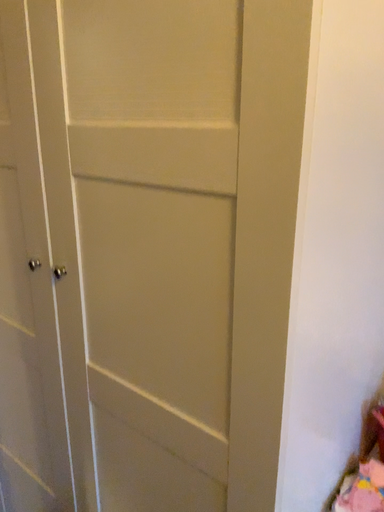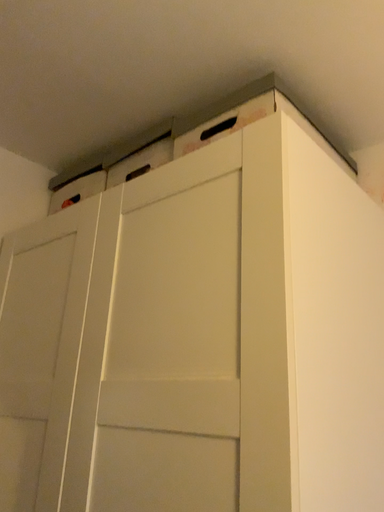
Question: How did the camera likely rotate when shooting the video?

Choices:
 (A) rotated upward
 (B) rotated downward

Answer: (A)